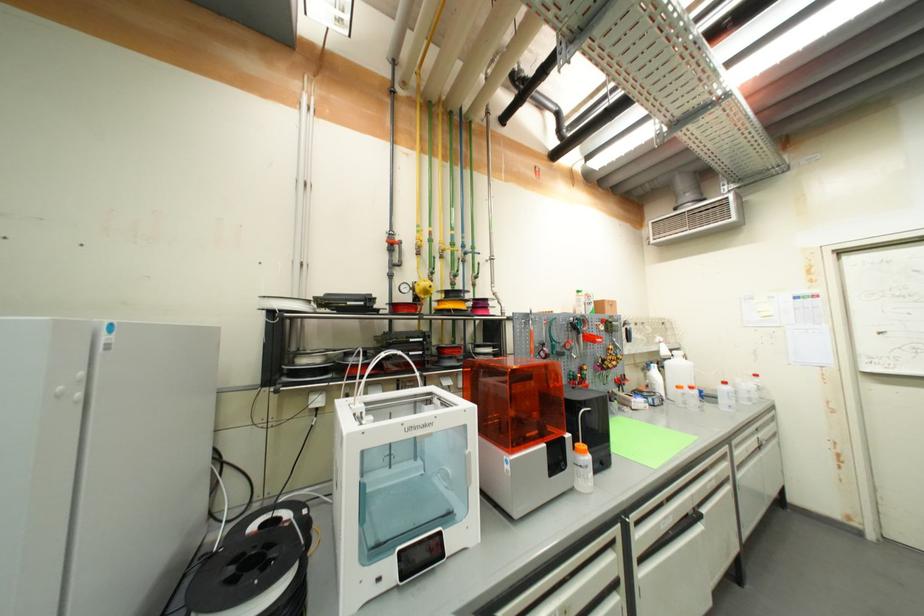
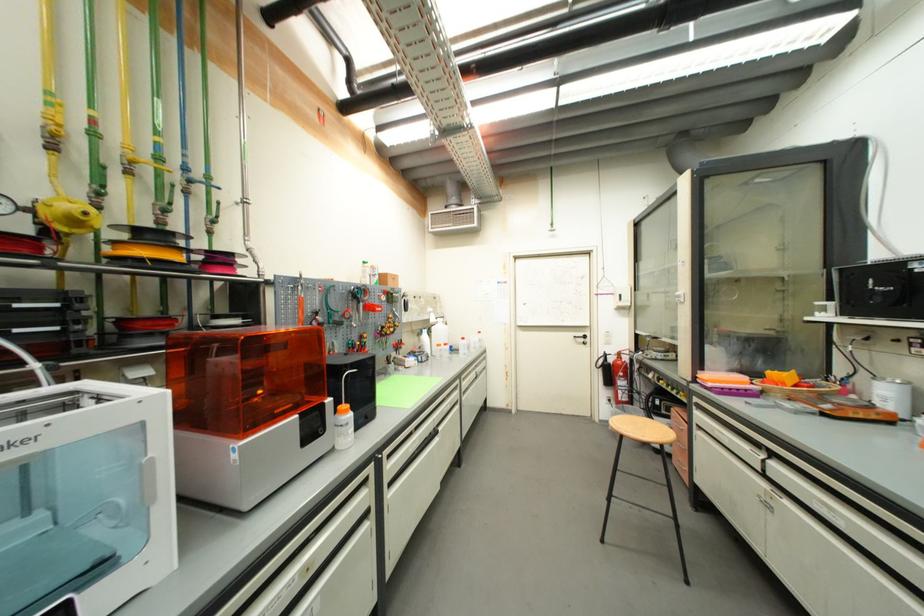
Locate, in the second image, the point that corresponds to point (588, 448) in the first image.

(349, 408)